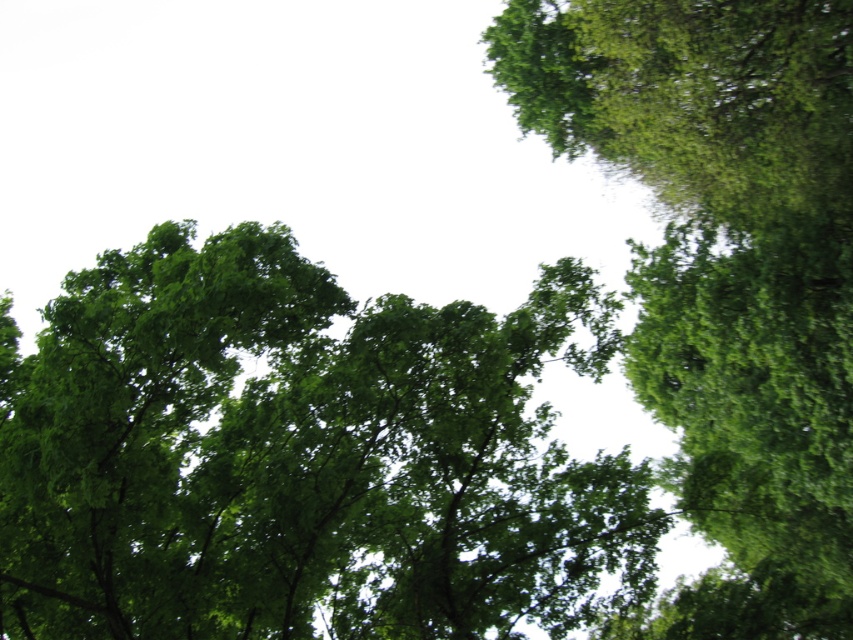
You are standing directly below the green leafy tree at center. If you look straight ahead, where would you see the tree relative to your field of view? Please provide the coordinates as a pair of numbers between 0 and 1, with 0,0 being the bottom left corner of your vision and 1,1 being the top right corner.

The green leafy tree at center is positioned at coordinates [299,456] in the image. Since you are standing directly below it and looking straight ahead, the tree would appear at approximately those coordinates in your field of view.

You are a bird flying towards the green leafy tree at upper right and the green leafy tree at center. Which tree will you reach first?

The green leafy tree at center will be reached first because it is positioned on the left side of the green leafy tree at upper right, meaning it is closer to your flight path.

You are standing under the trees and looking up. There is a point at coordinate [299,456]. What object is located at that point?

The point at coordinate [299,456] indicates a green leafy tree at center.